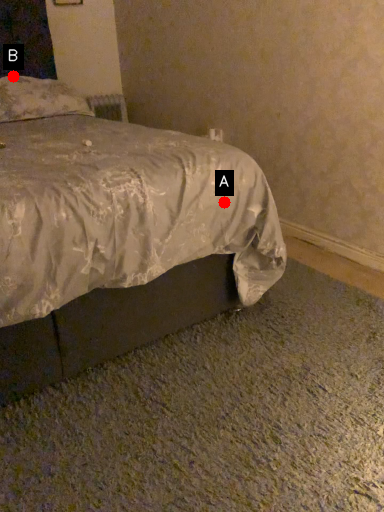
Question: Two points are circled on the image, labeled by A and B beside each circle. Which point is closer to the camera?

Choices:
 (A) A is closer
 (B) B is closer

Answer: (A)